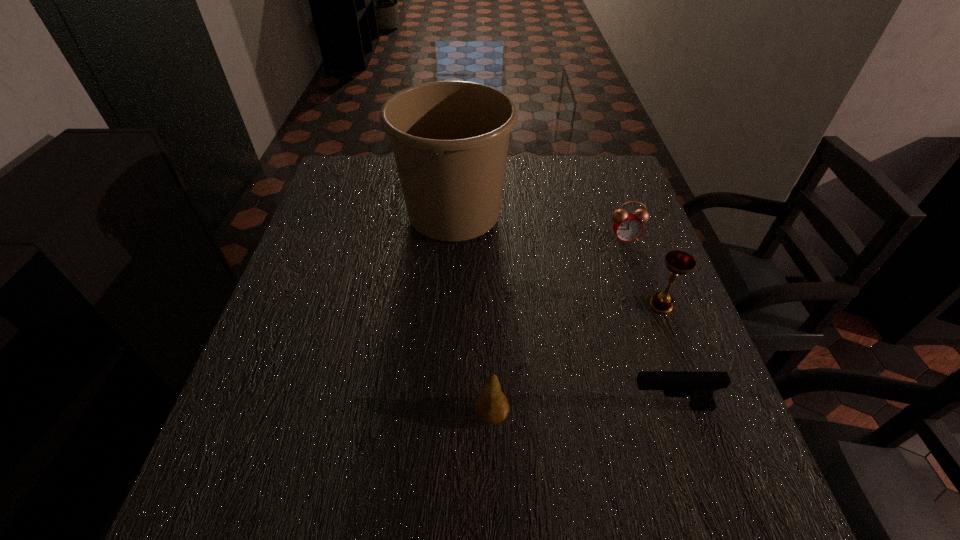
Locate an element on the screen. Image resolution: width=960 pixels, height=540 pixels. vacant space located 0.080m on the front-facing side of the pistol is located at coordinates (582, 406).

Locate an element on the screen. The image size is (960, 540). free spot located on the front-facing side of the pistol is located at coordinates (453, 406).

What are the coordinates of `free region located on the front-facing side of the pistol` in the screenshot? It's located at (453, 406).

Image resolution: width=960 pixels, height=540 pixels. I want to click on object located at the far edge, so click(x=450, y=139).

You are a GUI agent. You are given a task and a screenshot of the screen. Output one action in this format:
    pyautogui.click(x=<x>, y=<y>)
    Task: Click on the chalice at the right edge
    The width and height of the screenshot is (960, 540).
    Given the screenshot: What is the action you would take?
    pyautogui.click(x=678, y=262)

Find the location of `alarm clock that is positioned at the right edge`. alarm clock that is positioned at the right edge is located at coordinates (627, 226).

At what (x,y) coordinates should I click in order to perform the action: click on pistol situated at the right edge. Please return your answer as a coordinate pair (x, y). Image resolution: width=960 pixels, height=540 pixels. Looking at the image, I should click on (700, 386).

In the image, there is a desktop. In order to click on vacant space at the far edge in this screenshot , I will do `click(516, 177)`.

Find the location of a particular element. free location at the near edge is located at coordinates [x=451, y=530].

I want to click on free spot at the left edge of the desktop, so click(318, 214).